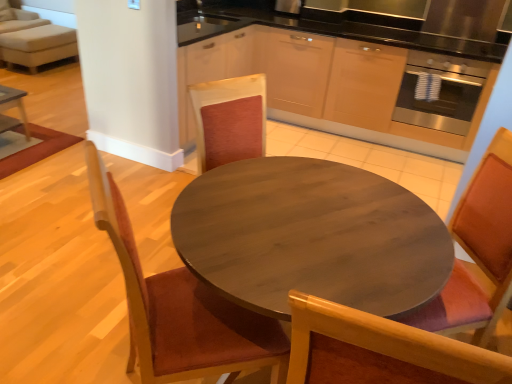
Find the location of a particular element. This screenshot has width=512, height=384. vacant space to the left of wooden chair at left, placed as the second chair when sorted from right to left is located at coordinates 79,338.